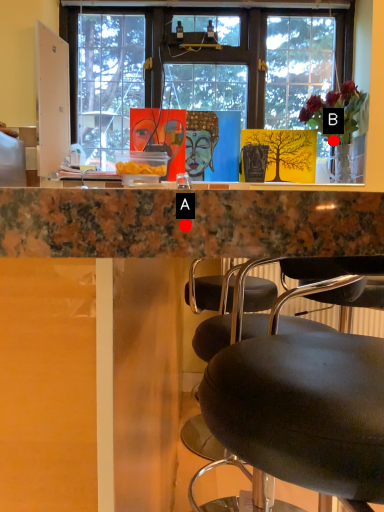
Question: Two points are circled on the image, labeled by A and B beside each circle. Among these points, which one is farthest from the camera?

Choices:
 (A) A is further
 (B) B is further

Answer: (B)